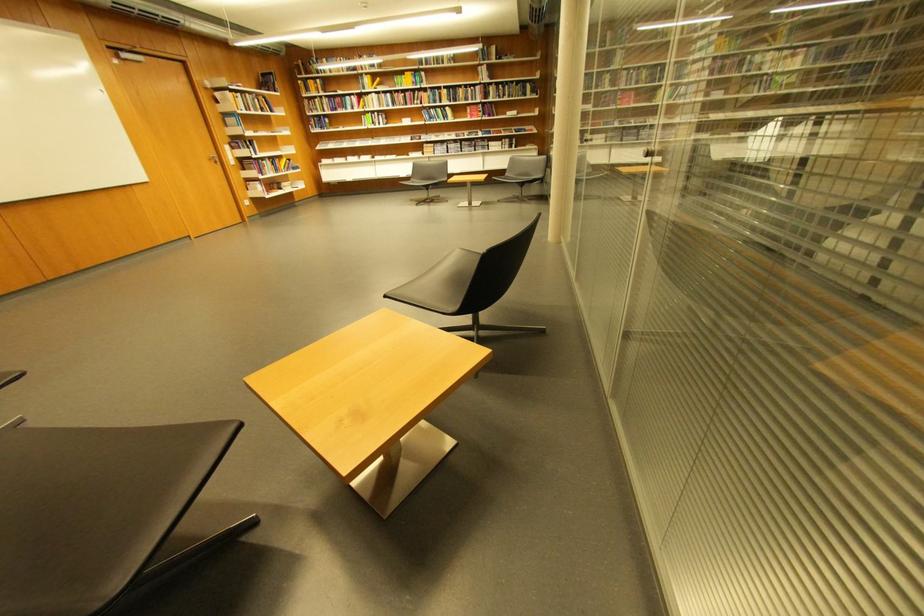
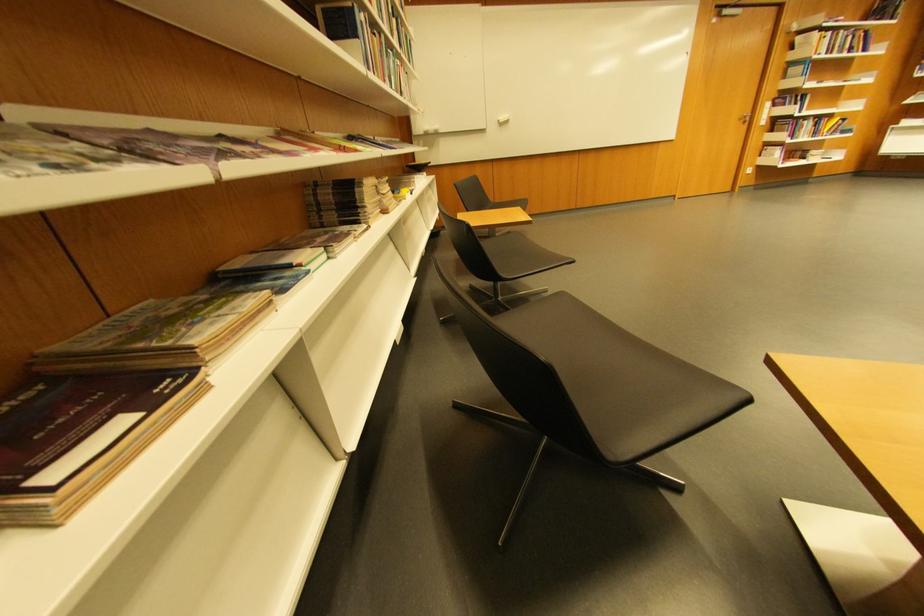
In the scene shown: The first image is from the beginning of the video and the second image is from the end. How did the camera likely rotate when shooting the video?

The camera's rotation is toward left-down.